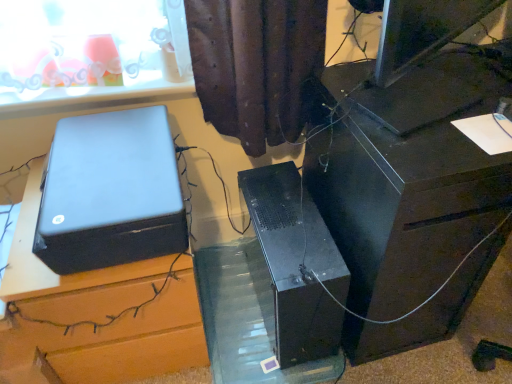
Question: From a real-world perspective, is satin black printer at left on transparent plastic glass table at center?

Choices:
 (A) no
 (B) yes

Answer: (B)

Question: Is satin black printer at left not inside transparent plastic glass table at center?

Choices:
 (A) no
 (B) yes

Answer: (B)

Question: Considering the relative sizes of satin black printer at left and transparent plastic glass table at center in the image provided, is satin black printer at left bigger than transparent plastic glass table at center?

Choices:
 (A) no
 (B) yes

Answer: (B)

Question: Considering the relative positions of satin black printer at left and transparent plastic glass table at center in the image provided, is satin black printer at left in front of transparent plastic glass table at center?

Choices:
 (A) yes
 (B) no

Answer: (A)

Question: Is satin black printer at left aimed at transparent plastic glass table at center?

Choices:
 (A) no
 (B) yes

Answer: (A)

Question: Considering the relative positions of black plastic desk at right, which is counted as the second furniture, starting from the left, and satin black printer at left in the image provided, is black plastic desk at right, which is counted as the second furniture, starting from the left, to the left or to the right of satin black printer at left?

Choices:
 (A) right
 (B) left

Answer: (A)

Question: From a real-world perspective, is black plastic desk at right, which is counted as the second furniture, starting from the left, physically located above or below satin black printer at left?

Choices:
 (A) below
 (B) above

Answer: (A)

Question: Is black plastic desk at right, which is counted as the second furniture, starting from the left, taller or shorter than satin black printer at left?

Choices:
 (A) short
 (B) tall

Answer: (B)

Question: From the image's perspective, is black plastic desk at right, which is counted as the second furniture, starting from the left, located above or below satin black printer at left?

Choices:
 (A) below
 (B) above

Answer: (A)

Question: Based on their positions, is black plastic speaker at upper left, positioned as the 2th furniture in right-to-left order, located to the left or right of satin black printer at left?

Choices:
 (A) right
 (B) left

Answer: (B)

Question: Do you think black plastic speaker at upper left, positioned as the 2th furniture in right-to-left order, is within satin black printer at left, or outside of it?

Choices:
 (A) outside
 (B) inside

Answer: (A)

Question: Is black plastic speaker at upper left, placed as the 1th furniture when sorted from left to right, wider or thinner than satin black printer at left?

Choices:
 (A) thin
 (B) wide

Answer: (B)

Question: From the image's perspective, is black plastic speaker at upper left, positioned as the 2th furniture in right-to-left order, above or below satin black printer at left?

Choices:
 (A) below
 (B) above

Answer: (A)

Question: Based on their sizes in the image, would you say transparent plastic glass table at center is bigger or smaller than black plastic speaker at upper left, positioned as the 2th furniture in right-to-left order?

Choices:
 (A) small
 (B) big

Answer: (A)

Question: Based on their positions, is transparent plastic glass table at center located to the left or right of black plastic speaker at upper left, placed as the 1th furniture when sorted from left to right?

Choices:
 (A) right
 (B) left

Answer: (A)